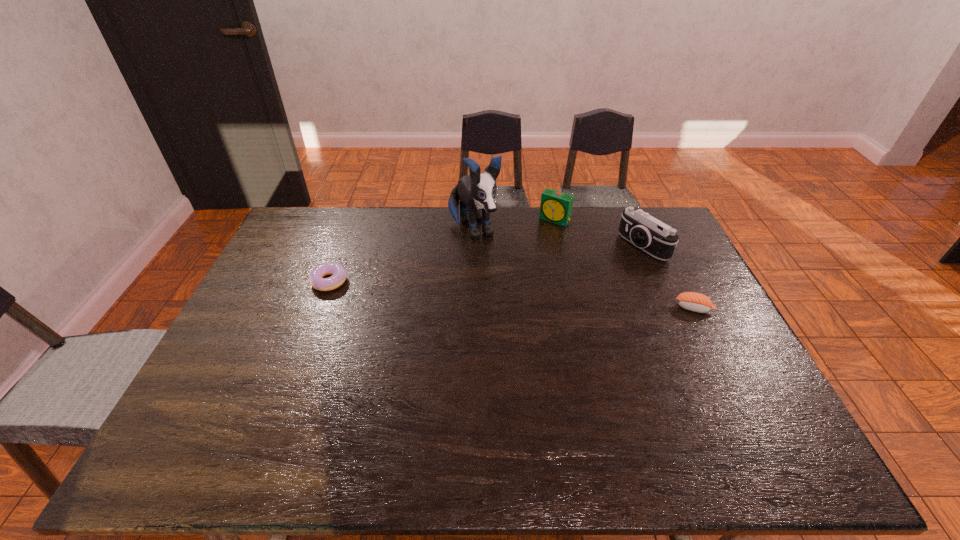
Identify the location of blank area at the near left corner. The width and height of the screenshot is (960, 540). (206, 422).

In the image, there is a desktop. Identify the location of free region at the far right corner. The image size is (960, 540). (656, 215).

This screenshot has width=960, height=540. Find the location of `free spot between the shortest object and the sushi`. free spot between the shortest object and the sushi is located at coordinates pos(512,294).

Identify the location of unoccupied area between the fourth object from right to left and the sushi. The height and width of the screenshot is (540, 960). (584, 269).

This screenshot has width=960, height=540. Find the location of `blank region between the third object from left to right and the doughnut`. blank region between the third object from left to right and the doughnut is located at coordinates (442, 250).

Find the location of a particular element. The image size is (960, 540). free space between the second shortest object and the third tallest object is located at coordinates (624, 264).

At what (x,y) coordinates should I click in order to perform the action: click on vacant space that's between the sushi and the alarm clock. Please return your answer as a coordinate pair (x, y). This screenshot has width=960, height=540. Looking at the image, I should click on (624, 264).

The image size is (960, 540). What are the coordinates of `vacant area between the second object from left to right and the doughnut` in the screenshot? It's located at (401, 255).

Locate an element on the screen. free spot between the camera and the alarm clock is located at coordinates (599, 233).

Where is `unoccupied position between the nearest object and the camera`? Image resolution: width=960 pixels, height=540 pixels. unoccupied position between the nearest object and the camera is located at coordinates point(668,277).